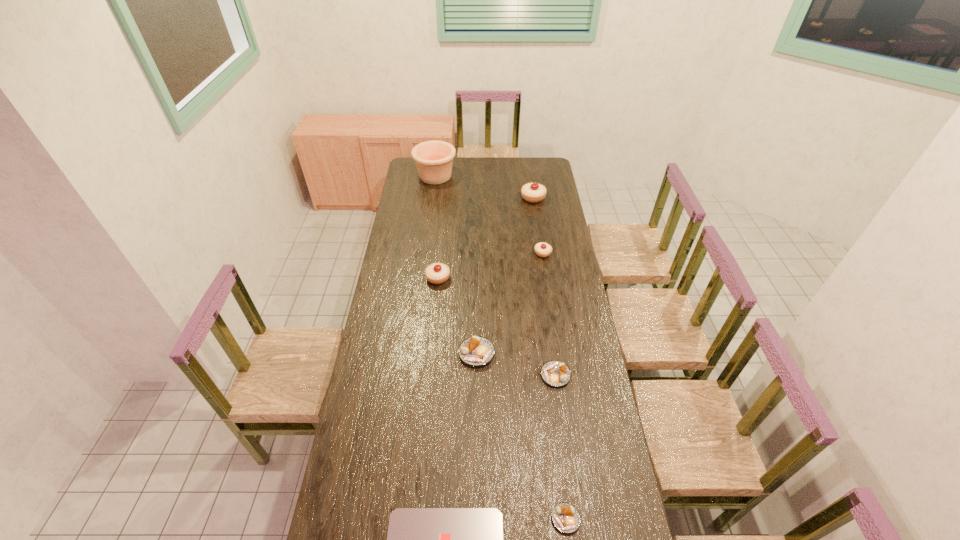
Where is `free space between the shortest pastry and the biggest brown pastry`? The width and height of the screenshot is (960, 540). free space between the shortest pastry and the biggest brown pastry is located at coordinates (521, 436).

This screenshot has height=540, width=960. In order to click on vacant area between the fifth tallest object and the biggest beige pastry in this screenshot , I will do `click(505, 275)`.

This screenshot has width=960, height=540. Identify the location of free space that is in between the tallest object and the fifth tallest object. (456, 265).

Identify which object is the third closest to the second tallest pastry. Please provide its 2D coordinates. Your answer should be formatted as a tuple, i.e. [(x, y)], where the tuple contains the x and y coordinates of a point satisfying the conditions above.

[(555, 373)]

Choose which object is the third nearest neighbor to the tallest object. Please provide its 2D coordinates. Your answer should be formatted as a tuple, i.e. [(x, y)], where the tuple contains the x and y coordinates of a point satisfying the conditions above.

[(437, 273)]

Identify which pastry is the third closest to the second pastry from left to right. Please provide its 2D coordinates. Your answer should be formatted as a tuple, i.e. [(x, y)], where the tuple contains the x and y coordinates of a point satisfying the conditions above.

[(566, 518)]

Find the location of a particular element. This screenshot has width=960, height=540. pastry that stands as the second closest to the second pastry from left to right is located at coordinates (437, 273).

I want to click on the third closest beige pastry to the smallest brown pastry, so click(x=533, y=192).

At what (x,y) coordinates should I click in order to perform the action: click on beige pastry that is the second closest to the farthest object. Please return your answer as a coordinate pair (x, y). The height and width of the screenshot is (540, 960). Looking at the image, I should click on (542, 249).

Where is `brown pastry that is the third closest to the farthest pastry`? The height and width of the screenshot is (540, 960). brown pastry that is the third closest to the farthest pastry is located at coordinates (566, 518).